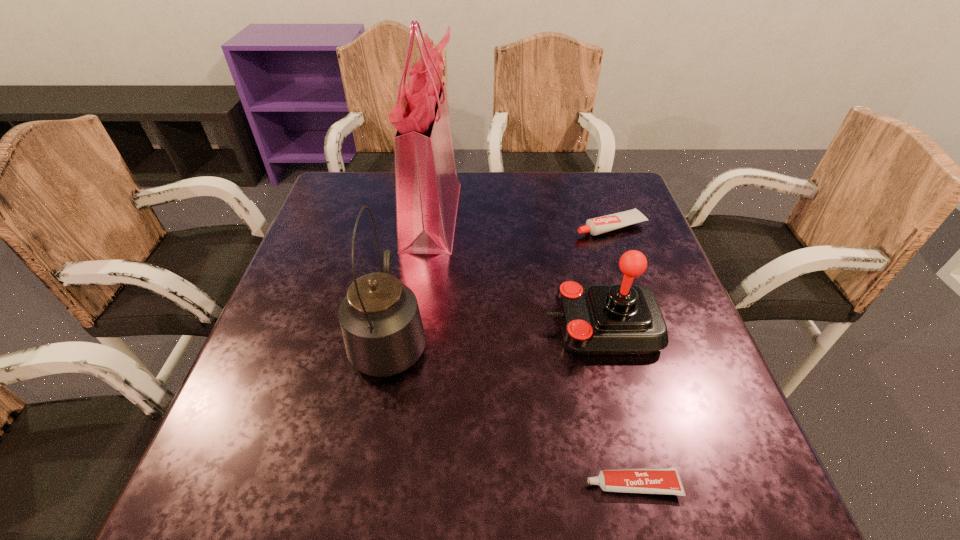
Image resolution: width=960 pixels, height=540 pixels. In order to click on object that is the second closest to the third shortest object in this screenshot , I will do `click(665, 480)`.

Point out which object is positioned as the nearest to the kettle. Please provide its 2D coordinates. Your answer should be formatted as a tuple, i.e. [(x, y)], where the tuple contains the x and y coordinates of a point satisfying the conditions above.

[(427, 188)]

The image size is (960, 540). What are the coordinates of `free location that satisfies the following two spatial constraints: 1. on the front side of the tallest object; 2. on the right side of the second shortest object` in the screenshot? It's located at (431, 226).

This screenshot has width=960, height=540. Identify the location of free space that satisfies the following two spatial constraints: 1. on the front side of the farther toothpaste; 2. on the base of the joystick. (645, 326).

Where is `vacant space that satisfies the following two spatial constraints: 1. spout on the farther toothpaste; 2. on the left side of the fourth shortest object`? The image size is (960, 540). vacant space that satisfies the following two spatial constraints: 1. spout on the farther toothpaste; 2. on the left side of the fourth shortest object is located at coordinates (411, 226).

You are a GUI agent. You are given a task and a screenshot of the screen. Output one action in this format:
    pyautogui.click(x=<x>, y=<y>)
    Task: Click on the free space in the image that satisfies the following two spatial constraints: 1. spout on the fourth shortest object; 2. on the right side of the second shortest object
    The height and width of the screenshot is (540, 960).
    Given the screenshot: What is the action you would take?
    pyautogui.click(x=411, y=226)

The height and width of the screenshot is (540, 960). What are the coordinates of `vacant space that satisfies the following two spatial constraints: 1. on the front side of the taller toothpaste; 2. on the left side of the shopping bag` in the screenshot? It's located at (431, 226).

Locate an element on the screen. free space that satisfies the following two spatial constraints: 1. spout on the taller toothpaste; 2. on the left side of the fourth shortest object is located at coordinates (411, 226).